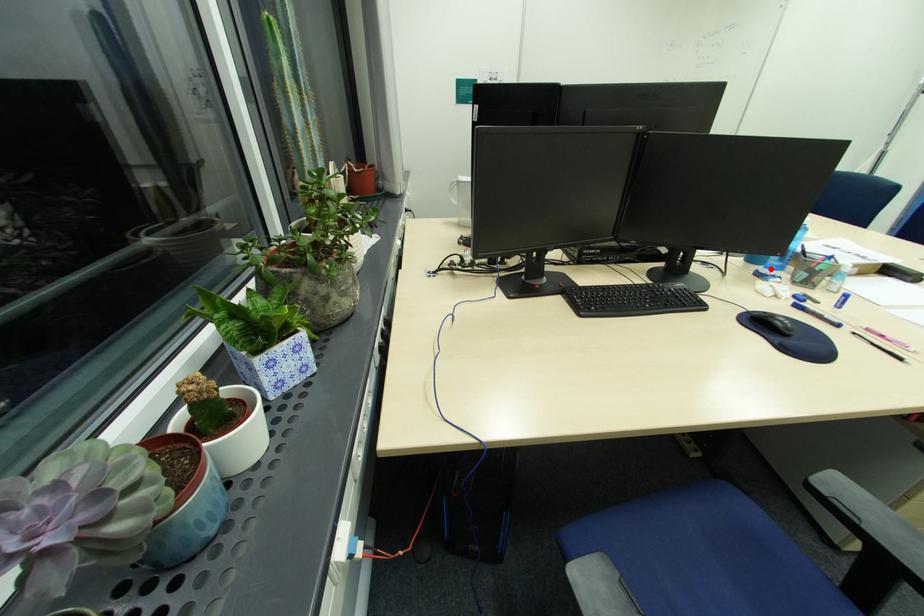
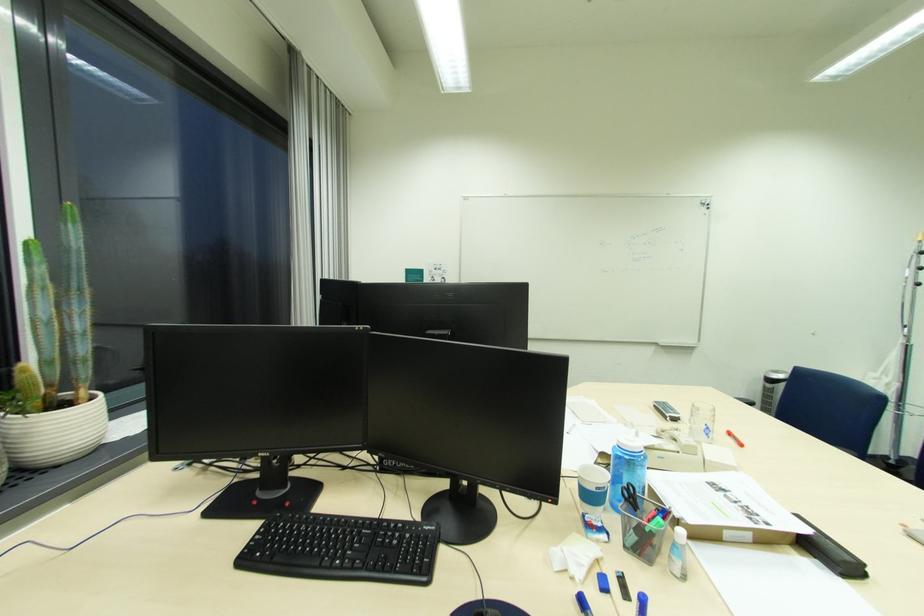
Find the pixel in the second image that matches the highlighted location in the first image.

(616, 511)